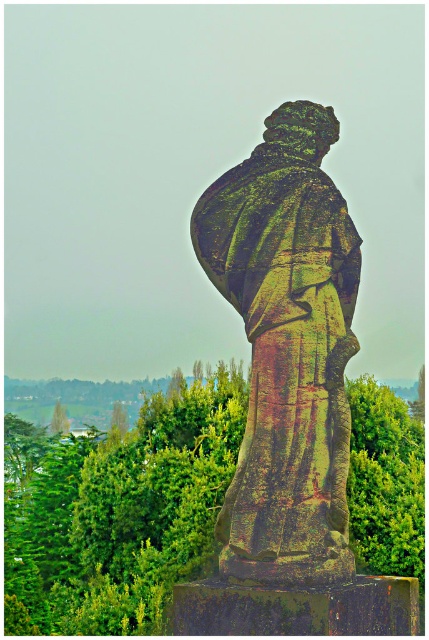
Question: Can you confirm if green leafy tree at center is positioned to the left of rusty stone statue at center?

Choices:
 (A) no
 (B) yes

Answer: (B)

Question: Which point is farther to the camera?

Choices:
 (A) (343, 424)
 (B) (69, 570)

Answer: (B)

Question: Which point is closer to the camera?

Choices:
 (A) rusty stone statue at center
 (B) green leafy tree at center

Answer: (A)

Question: Is green leafy tree at center above rusty stone statue at center?

Choices:
 (A) yes
 (B) no

Answer: (B)

Question: Does green leafy tree at center have a smaller size compared to rusty stone statue at center?

Choices:
 (A) yes
 (B) no

Answer: (B)